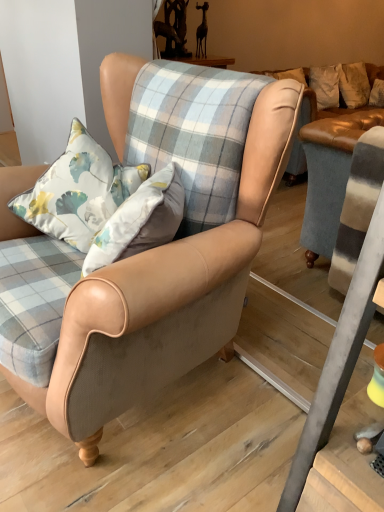
Question: Which is correct: matte leather armchair at center is inside floral fabric cushion at center, or outside of it?

Choices:
 (A) outside
 (B) inside

Answer: (A)

Question: Looking at their shapes, would you say matte leather armchair at center is wider or thinner than floral fabric cushion at center?

Choices:
 (A) thin
 (B) wide

Answer: (B)

Question: From the image's perspective, is matte leather armchair at center positioned above or below floral fabric cushion at center?

Choices:
 (A) below
 (B) above

Answer: (A)

Question: In terms of size, does floral fabric cushion at center appear bigger or smaller than matte leather armchair at center?

Choices:
 (A) small
 (B) big

Answer: (A)

Question: Considering the positions of floral fabric cushion at center and matte leather armchair at center in the image, is floral fabric cushion at center taller or shorter than matte leather armchair at center?

Choices:
 (A) short
 (B) tall

Answer: (A)

Question: Is floral fabric cushion at center wider or thinner than matte leather armchair at center?

Choices:
 (A) thin
 (B) wide

Answer: (A)

Question: Is point (67, 202) closer or farther from the camera than point (206, 231)?

Choices:
 (A) farther
 (B) closer

Answer: (A)